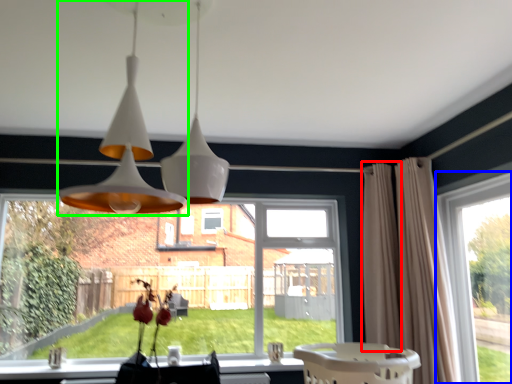
Question: Which object is positioned closest to curtain (highlighted by a red box)? Select from window (highlighted by a blue box) and lamp (highlighted by a green box).

Choices:
 (A) window
 (B) lamp

Answer: (A)